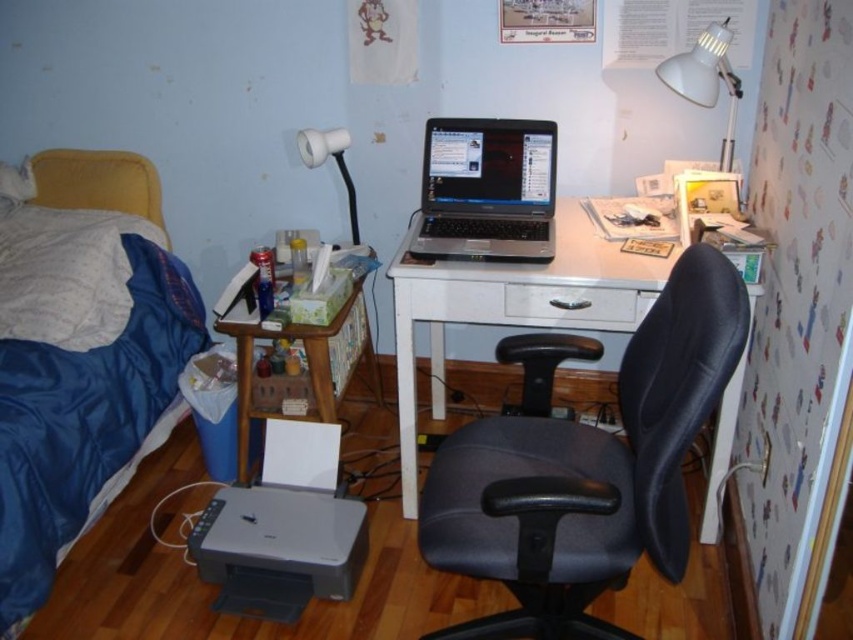
Based on the photo, can you confirm if black leather swivel chair at center is positioned below gray matte printer at lower left?

Actually, black leather swivel chair at center is above gray matte printer at lower left.

Is point (505, 634) positioned behind point (323, 561)?

No.

This screenshot has height=640, width=853. Identify the location of black leather swivel chair at center. click(x=589, y=472).

Find the location of a particular element. The width and height of the screenshot is (853, 640). black leather swivel chair at center is located at coordinates (589, 472).

Can you confirm if gray matte printer at lower left is wider than white plastic lamp at upper center?

Correct, the width of gray matte printer at lower left exceeds that of white plastic lamp at upper center.

Is point (215, 576) closer to viewer compared to point (335, 129)?

Yes.

Who is more forward, (x=328, y=564) or (x=352, y=195)?

Point (x=328, y=564)

This screenshot has height=640, width=853. In order to click on gray matte printer at lower left in this screenshot , I will do `click(277, 548)`.

At what (x,y) coordinates should I click in order to perform the action: click on black leather swivel chair at center. Please return your answer as a coordinate pair (x, y). Looking at the image, I should click on (589, 472).

Does point (674, 541) lie behind point (727, 68)?

That is False.

Identify the location of black leather swivel chair at center. This screenshot has height=640, width=853. (589, 472).